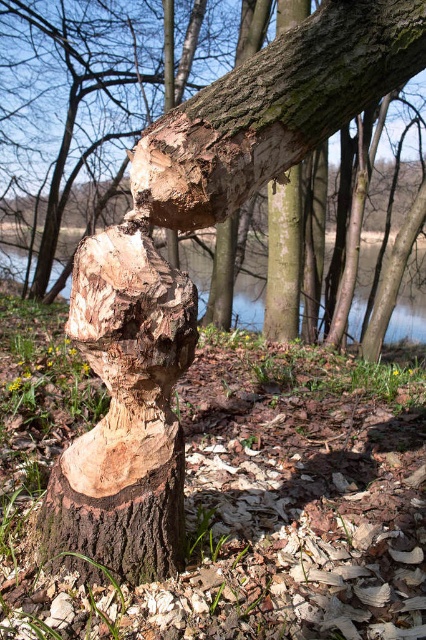
Consider the image. Is the position of natural wood tree stump at center less distant than that of transparent water at center?

Yes, natural wood tree stump at center is closer to the viewer.

Is natural wood tree stump at center to the right of transparent water at center from the viewer's perspective?

In fact, natural wood tree stump at center is to the left of transparent water at center.

Which is behind, point (157, 275) or point (389, 333)?

Point (389, 333)

Locate an element on the screen. The image size is (426, 640). natural wood tree stump at center is located at coordinates [x=124, y=413].

Can you confirm if smooth brown wood at center is wider than transparent water at center?

Correct, the width of smooth brown wood at center exceeds that of transparent water at center.

Is smooth brown wood at center further to the viewer compared to transparent water at center?

No, smooth brown wood at center is in front of transparent water at center.

The width and height of the screenshot is (426, 640). What do you see at coordinates (273, 109) in the screenshot?
I see `smooth brown wood at center` at bounding box center [273, 109].

The image size is (426, 640). What are the coordinates of `smooth brown wood at center` in the screenshot? It's located at (273, 109).

Is natural wood tree stump at center taller than smooth brown wood at center?

Yes.

Is natural wood tree stump at center bigger than smooth brown wood at center?

No.

Between point (92, 339) and point (288, 54), which one is positioned in front?

Point (92, 339) is in front.

At what (x,y) coordinates should I click in order to perform the action: click on natural wood tree stump at center. Please return your answer as a coordinate pair (x, y). This screenshot has height=640, width=426. Looking at the image, I should click on (124, 413).